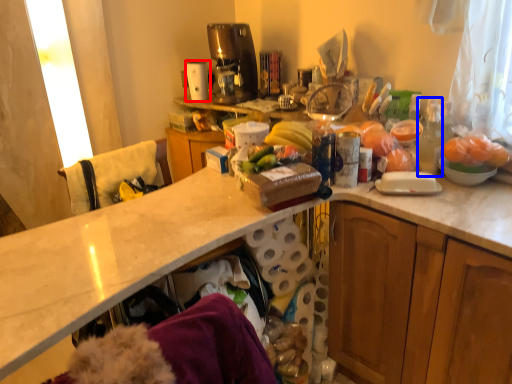
Question: Which object is closer to the camera taking this photo, appliance (highlighted by a red box) or bottle (highlighted by a blue box)?

Choices:
 (A) appliance
 (B) bottle

Answer: (B)